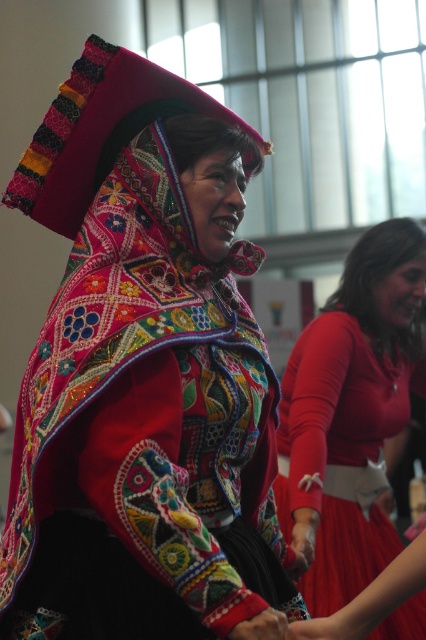
You are standing in front of the image and want to describe the position of the embroidered fabric shawl at center. What are its coordinates?

The embroidered fabric shawl at center is located at coordinates (144,376).

You are a photographer planning to capture a closeup of the traditional attire in the image. Since you want to focus on the entire width of both the embroidered fabric shawl at center and the matte red dress at center, which one should you adjust your camera angle to accommodate?

You should adjust your camera angle to accommodate the embroidered fabric shawl at center because its width surpasses that of the matte red dress at center, requiring a wider frame to capture its full extent.